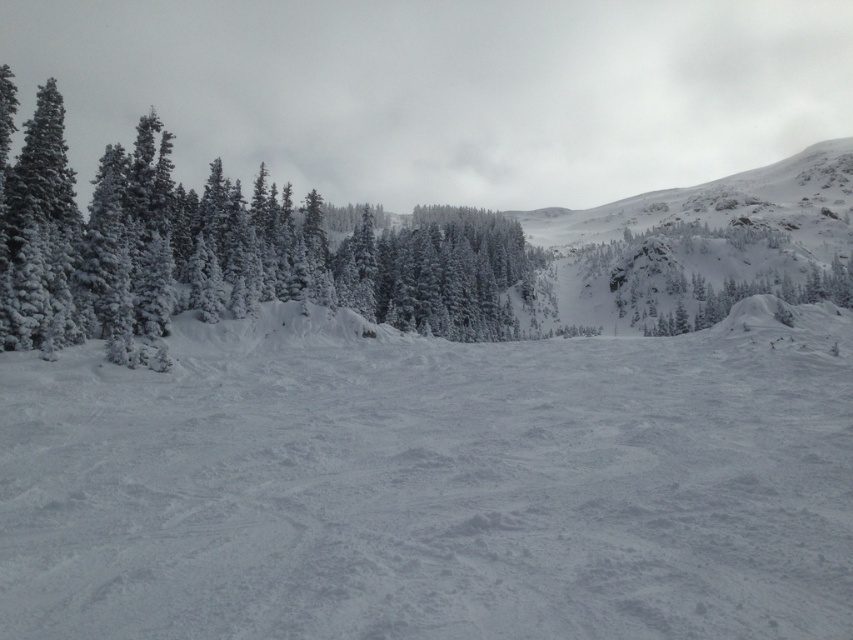
Question: Observing the image, what is the correct spatial positioning of white snow at center in reference to white frosty trees at left?

Choices:
 (A) below
 (B) above

Answer: (A)

Question: Which object appears closest to the camera in this image?

Choices:
 (A) white snow at center
 (B) white frosty trees at left

Answer: (A)

Question: Does white snow at center have a lesser width compared to white frosty trees at left?

Choices:
 (A) no
 (B) yes

Answer: (B)

Question: Is white snow at center below white frosty trees at left?

Choices:
 (A) no
 (B) yes

Answer: (B)